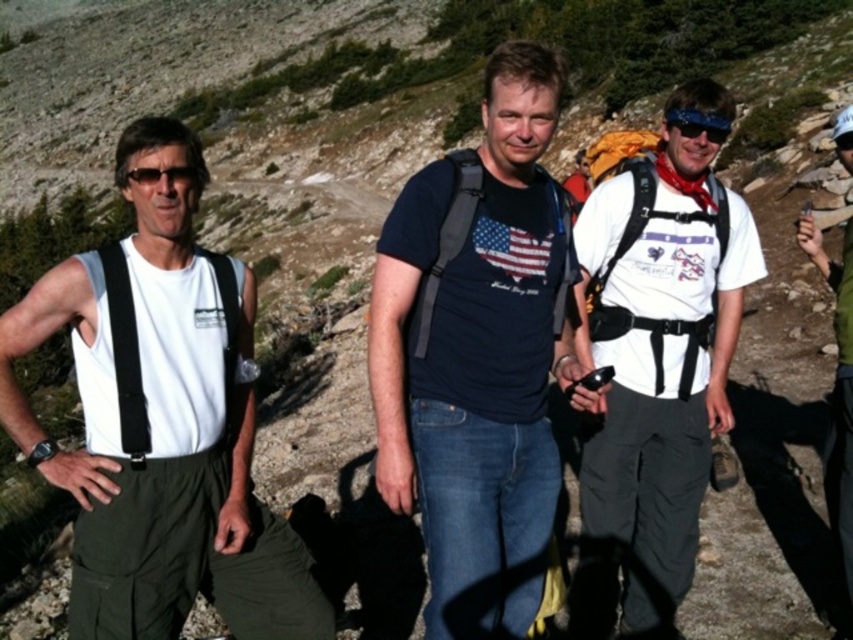
Question: Considering the real-world distances, which object is closest to the blue reflective lens sunglasses at upper right?

Choices:
 (A) white matte tank top at left
 (B) matte black backpack at center
 (C) black fabric suspenders at left
 (D) dark blue t-shirt at center

Answer: (B)

Question: Is matte black backpack at center positioned before blue reflective lens sunglasses at upper right?

Choices:
 (A) yes
 (B) no

Answer: (A)

Question: Is white matte tank top at left thinner than black fabric suspenders at left?

Choices:
 (A) no
 (B) yes

Answer: (A)

Question: Does white matte t-shirt at center have a larger size compared to matte black backpack at center?

Choices:
 (A) no
 (B) yes

Answer: (A)

Question: Which point is farther to the camera?

Choices:
 (A) (194, 545)
 (B) (236, 340)

Answer: (B)

Question: Which object is the farthest from the white matte tank top at left?

Choices:
 (A) blue reflective lens sunglasses at upper right
 (B) matte black backpack at center

Answer: (B)